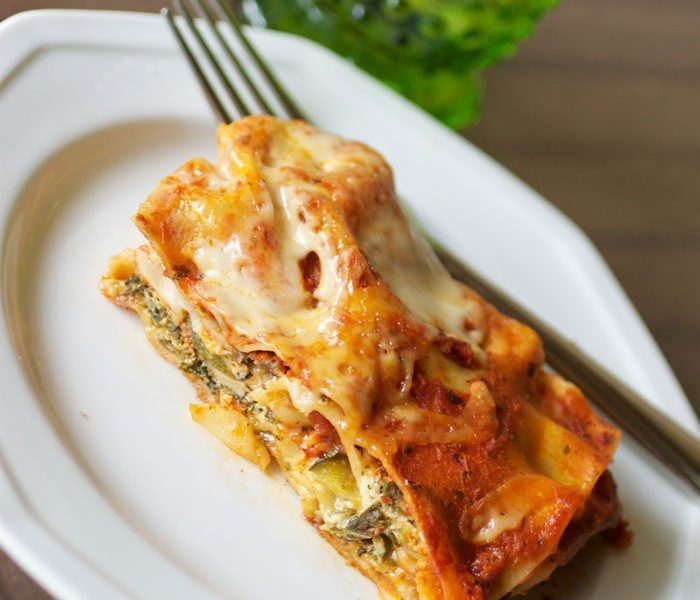
This screenshot has height=600, width=700. Find the location of `fork`. fork is located at coordinates (281, 100).